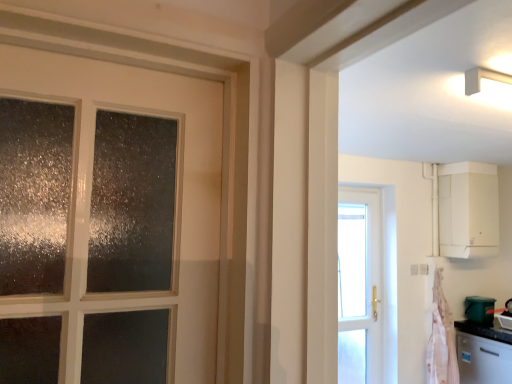
Question: From a real-world perspective, is pink fabric at right on top of satin silver dishwasher at lower right?

Choices:
 (A) no
 (B) yes

Answer: (B)

Question: Can you confirm if pink fabric at right is positioned to the left of satin silver dishwasher at lower right?

Choices:
 (A) no
 (B) yes

Answer: (B)

Question: Considering the relative sizes of pink fabric at right and satin silver dishwasher at lower right in the image provided, is pink fabric at right smaller than satin silver dishwasher at lower right?

Choices:
 (A) yes
 (B) no

Answer: (A)

Question: Is pink fabric at right looking in the opposite direction of satin silver dishwasher at lower right?

Choices:
 (A) no
 (B) yes

Answer: (A)

Question: From the image's perspective, is pink fabric at right on satin silver dishwasher at lower right?

Choices:
 (A) no
 (B) yes

Answer: (B)

Question: Would you say pink fabric at right is outside satin silver dishwasher at lower right?

Choices:
 (A) yes
 (B) no

Answer: (A)

Question: Does pink fabric at right have a greater height compared to white matte cabinet at upper right?

Choices:
 (A) yes
 (B) no

Answer: (A)

Question: Does pink fabric at right have a smaller size compared to white matte cabinet at upper right?

Choices:
 (A) yes
 (B) no

Answer: (A)

Question: Could you tell me if pink fabric at right is facing white matte cabinet at upper right?

Choices:
 (A) yes
 (B) no

Answer: (B)

Question: Is pink fabric at right bigger than white matte cabinet at upper right?

Choices:
 (A) no
 (B) yes

Answer: (A)

Question: Is pink fabric at right positioned with its back to white matte cabinet at upper right?

Choices:
 (A) yes
 (B) no

Answer: (B)

Question: Is pink fabric at right positioned behind white matte cabinet at upper right?

Choices:
 (A) no
 (B) yes

Answer: (A)

Question: Is pink fabric at right positioned before green plastic bucket at lower right?

Choices:
 (A) no
 (B) yes

Answer: (B)